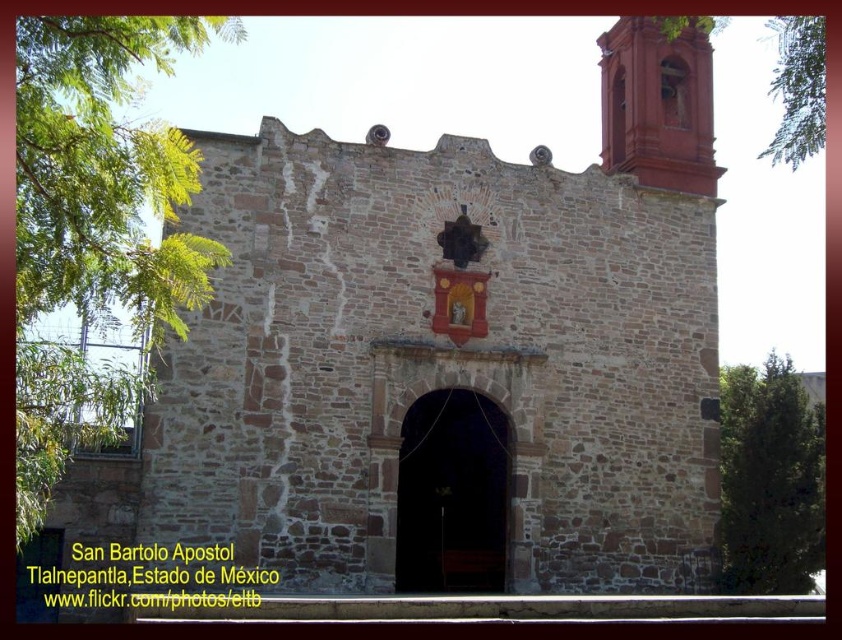
Question: Is brown stone chapel at center thinner than smooth red bell tower at upper right?

Choices:
 (A) no
 (B) yes

Answer: (A)

Question: Among these objects, which one is nearest to the camera?

Choices:
 (A) brown stone chapel at center
 (B) smooth red bell tower at upper right

Answer: (A)

Question: Does brown stone chapel at center have a larger size compared to smooth red bell tower at upper right?

Choices:
 (A) yes
 (B) no

Answer: (A)

Question: Which point is closer to the camera?

Choices:
 (A) smooth red bell tower at upper right
 (B) brown stone chapel at center

Answer: (B)

Question: Among these objects, which one is farthest from the camera?

Choices:
 (A) brown stone chapel at center
 (B) smooth red bell tower at upper right

Answer: (B)

Question: Does brown stone chapel at center have a lesser width compared to smooth red bell tower at upper right?

Choices:
 (A) no
 (B) yes

Answer: (A)